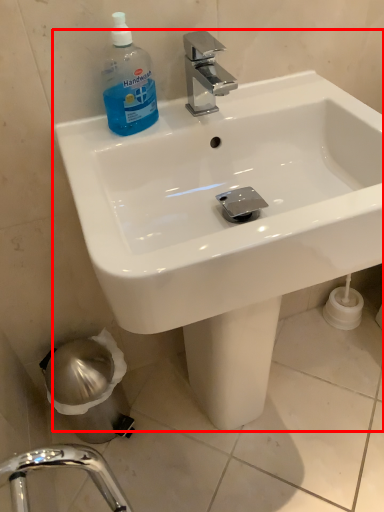
Question: From the image's perspective, what is the correct spatial positioning of sink (annotated by the red box) in reference to cleaning product?

Choices:
 (A) above
 (B) below

Answer: (B)